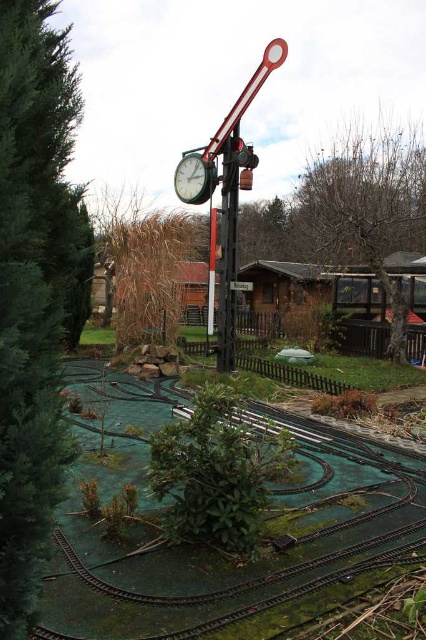
Question: Which point appears closest to the camera in this image?

Choices:
 (A) (293, 499)
 (B) (317, 221)
 (C) (54, 177)
 (D) (187, 154)

Answer: (C)

Question: Which of the following is the farthest from the observer?

Choices:
 (A) green rubber train track at lower center
 (B) metallic pole at center
 (C) metallic clock at center
 (D) green textured hedge at left

Answer: (C)

Question: Is bare branches at right positioned before metallic pole at center?

Choices:
 (A) no
 (B) yes

Answer: (A)

Question: Where is brown grass at center located in relation to metallic clock at center in the image?

Choices:
 (A) above
 (B) below

Answer: (A)

Question: Does green rubber train track at lower center lie behind bare branches at right?

Choices:
 (A) yes
 (B) no

Answer: (B)

Question: Which point appears closest to the camera in this image?

Choices:
 (A) (365, 141)
 (B) (103, 253)
 (C) (219, 340)
 (D) (408, 492)

Answer: (D)